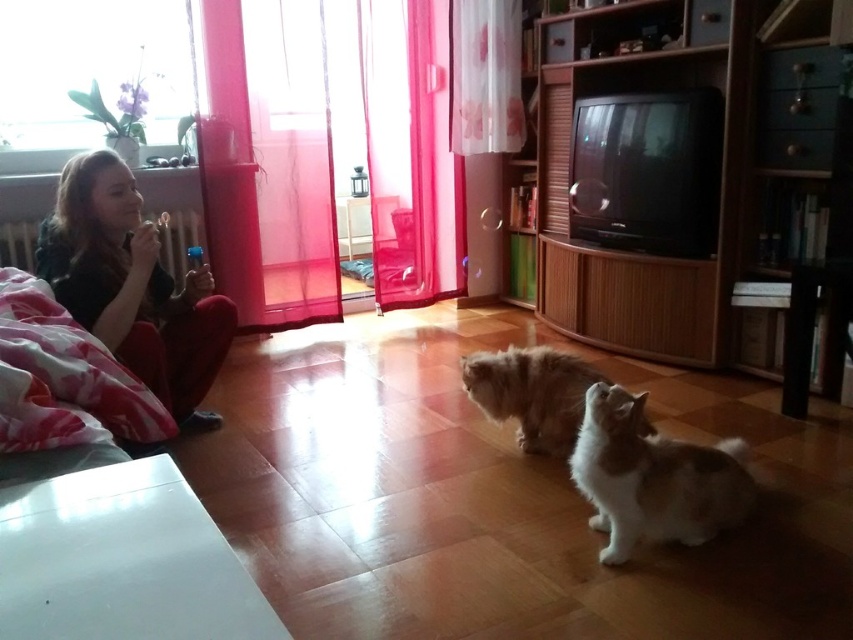
Question: Does white and brown fur cat at center appear on the left side of fluffy brown cat at center?

Choices:
 (A) no
 (B) yes

Answer: (A)

Question: Which of the following is the closest to the observer?

Choices:
 (A) fluffy brown cat at center
 (B) matte black shirt at left
 (C) translucent floral-patterned curtain at upper center

Answer: (B)

Question: Is translucent floral-patterned curtain at upper center above fluffy brown cat at center?

Choices:
 (A) no
 (B) yes

Answer: (B)

Question: Which object is closer to the camera taking this photo?

Choices:
 (A) matte black shirt at left
 (B) white and brown fur cat at center
 (C) translucent floral-patterned curtain at upper center
 (D) translucent pink curtain at center

Answer: (B)

Question: Which point is farther to the camera?

Choices:
 (A) (402, 106)
 (B) (169, 408)
 (C) (500, 125)

Answer: (A)

Question: Is translucent floral-patterned curtain at upper center bigger than fluffy brown cat at center?

Choices:
 (A) yes
 (B) no

Answer: (A)